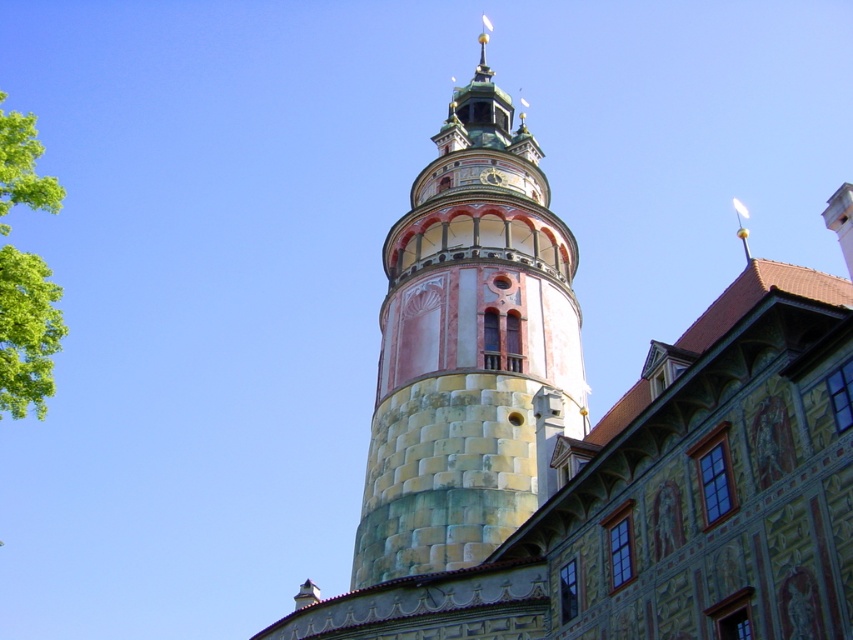
Is point (482, 138) more distant than point (15, 380)?

Yes.

Can you confirm if stone tower at center is wider than green leafy tree at left?

In fact, stone tower at center might be narrower than green leafy tree at left.

Image resolution: width=853 pixels, height=640 pixels. I want to click on stone tower at center, so click(467, 348).